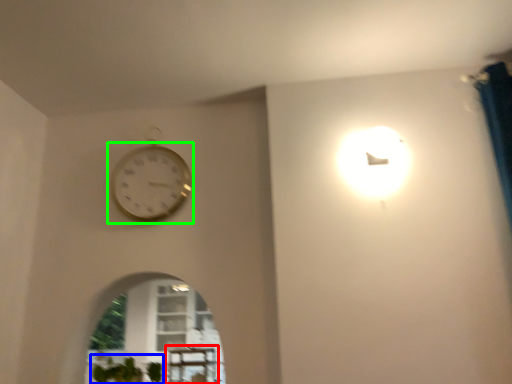
Question: Which object is the closest to the table (highlighted by a red box)? Choose among these: plant (highlighted by a blue box) or wall clock (highlighted by a green box).

Choices:
 (A) plant
 (B) wall clock

Answer: (A)